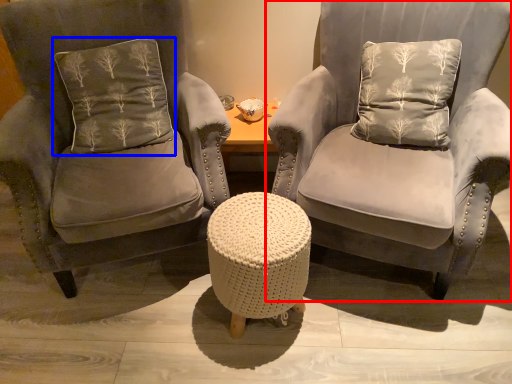
Question: Which object is closer to the camera taking this photo, chair (highlighted by a red box) or pillow (highlighted by a blue box)?

Choices:
 (A) chair
 (B) pillow

Answer: (A)